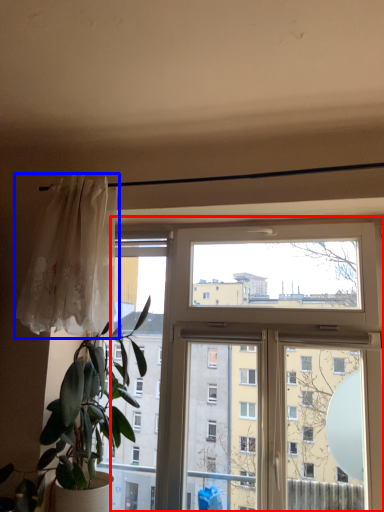
Question: Which point is further to the camera, window (highlighted by a red box) or curtain (highlighted by a blue box)?

Choices:
 (A) window
 (B) curtain

Answer: (B)